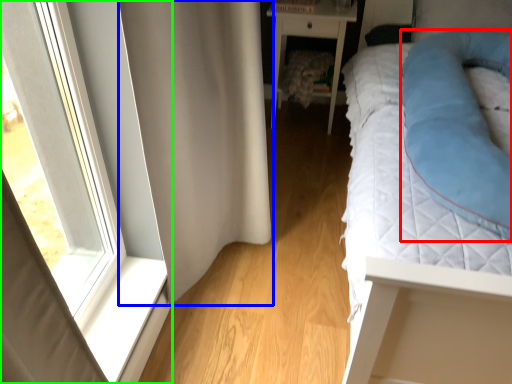
Question: Which object is the closest to the cat bed (highlighted by a red box)? Choose among these: curtain (highlighted by a blue box) or window (highlighted by a green box).

Choices:
 (A) curtain
 (B) window

Answer: (A)